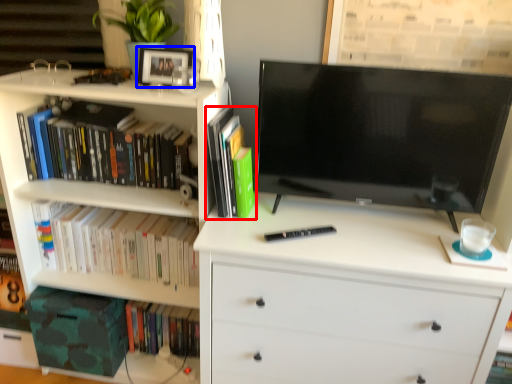
Question: Which of the following is the closest to the observer, book (highlighted by a red box) or picture frame (highlighted by a blue box)?

Choices:
 (A) book
 (B) picture frame

Answer: (A)